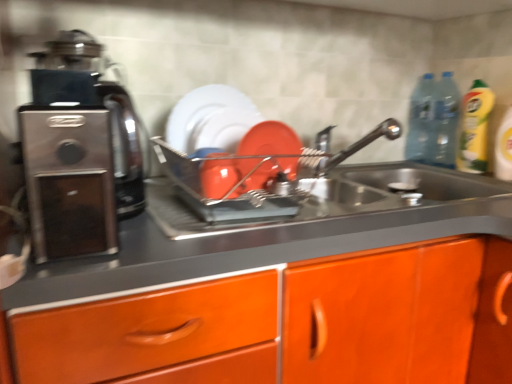
Question: From a real-world perspective, is matte orange plate at center below transparent plastic bottle at upper right, which ranks as the first bottle in left-to-right order?

Choices:
 (A) no
 (B) yes

Answer: (B)

Question: Does matte orange plate at center appear on the left side of transparent plastic bottle at upper right, which is the 2th bottle in right-to-left order?

Choices:
 (A) no
 (B) yes

Answer: (B)

Question: From the image's perspective, would you say matte orange plate at center is shown under transparent plastic bottle at upper right, which ranks as the first bottle in left-to-right order?

Choices:
 (A) yes
 (B) no

Answer: (A)

Question: Can you confirm if matte orange plate at center is wider than transparent plastic bottle at upper right, which is the 2th bottle in right-to-left order?

Choices:
 (A) no
 (B) yes

Answer: (A)

Question: Considering the relative positions of matte orange plate at center and transparent plastic bottle at upper right, which is the 2th bottle in right-to-left order, in the image provided, is matte orange plate at center in front of transparent plastic bottle at upper right, which is the 2th bottle in right-to-left order,?

Choices:
 (A) yes
 (B) no

Answer: (A)

Question: Is matte orange plate at center to the right of transparent plastic bottle at upper right, which is the 2th bottle in right-to-left order, from the viewer's perspective?

Choices:
 (A) yes
 (B) no

Answer: (B)

Question: Is there a large distance between satin black coffee machine at left and yellow liquid bottle at right?

Choices:
 (A) no
 (B) yes

Answer: (B)

Question: From the image's perspective, does satin black coffee machine at left appear higher than yellow liquid bottle at right?

Choices:
 (A) no
 (B) yes

Answer: (A)

Question: Is satin black coffee machine at left positioned before yellow liquid bottle at right?

Choices:
 (A) no
 (B) yes

Answer: (B)

Question: Can you confirm if satin black coffee machine at left is smaller than yellow liquid bottle at right?

Choices:
 (A) no
 (B) yes

Answer: (A)

Question: Does satin black coffee machine at left appear on the left side of yellow liquid bottle at right?

Choices:
 (A) yes
 (B) no

Answer: (A)

Question: Is satin black coffee machine at left next to yellow liquid bottle at right?

Choices:
 (A) no
 (B) yes

Answer: (A)

Question: Is transparent plastic bottle at upper right, which is the first bottle in right-to-left order, at the right side of transparent plastic bottle at upper right, which ranks as the first bottle in left-to-right order?

Choices:
 (A) no
 (B) yes

Answer: (B)